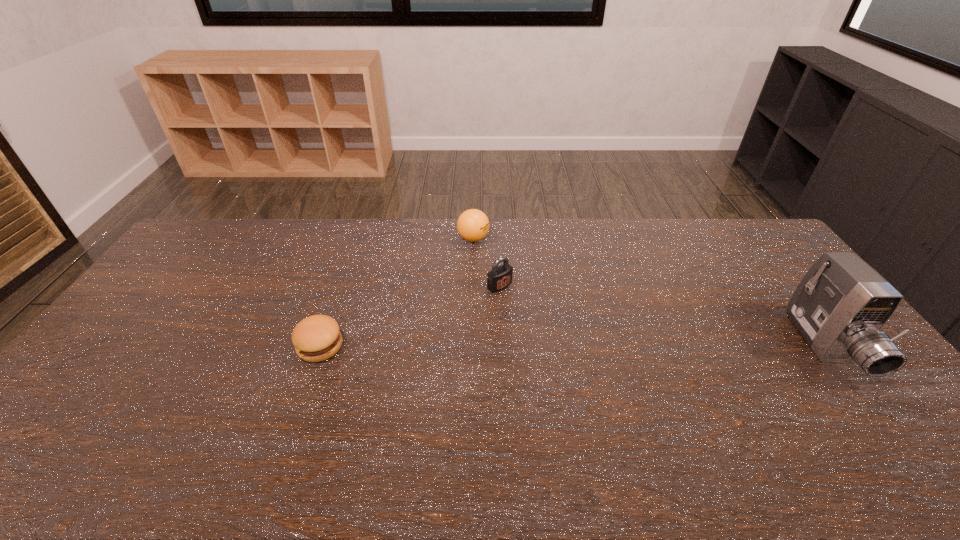
This screenshot has width=960, height=540. Identify the location of the leftmost object. (316, 338).

The image size is (960, 540). I want to click on the shortest object, so click(316, 338).

Where is `the tallest object`? This screenshot has width=960, height=540. the tallest object is located at coordinates (839, 307).

Find the location of a particular element. the rightmost object is located at coordinates (839, 307).

The height and width of the screenshot is (540, 960). What are the coordinates of `padlock` in the screenshot? It's located at (500, 277).

Find the location of a particular element. This screenshot has width=960, height=540. ping-pong ball is located at coordinates (473, 225).

Image resolution: width=960 pixels, height=540 pixels. I want to click on vacant space located on the back of the hamburger, so click(330, 317).

Where is `free space located 0.060m at the front of the rightmost object, highlighting the lens`? This screenshot has width=960, height=540. free space located 0.060m at the front of the rightmost object, highlighting the lens is located at coordinates (874, 411).

I want to click on blank area located on the front of the padlock near the keyhole, so click(x=520, y=302).

Where is `vacant space located on the front of the padlock near the keyhole`? vacant space located on the front of the padlock near the keyhole is located at coordinates (526, 307).